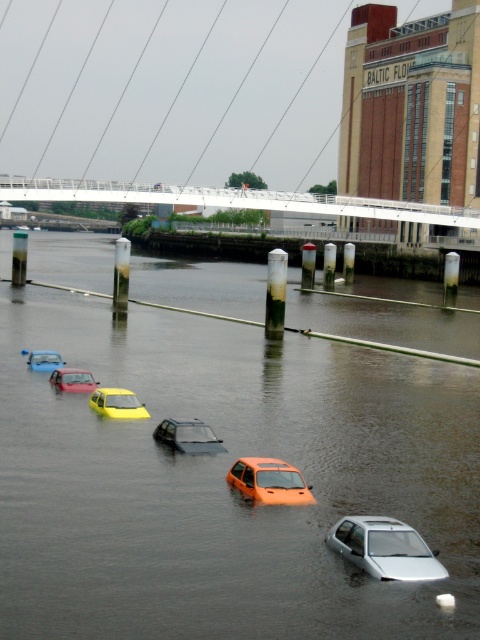
Can you confirm if metallic silver car at lower center is taller than metallic silver car at lower left?

No, metallic silver car at lower center is not taller than metallic silver car at lower left.

Identify the location of metallic silver car at lower center. (72, 380).

Between smooth water at center and shiny black car at center, which one has more height?

With more height is smooth water at center.

What do you see at coordinates (224, 481) in the screenshot? I see `smooth water at center` at bounding box center [224, 481].

This screenshot has height=640, width=480. I want to click on smooth water at center, so click(224, 481).

Who is taller, white matte car at lower right or shiny black car at center?

shiny black car at center is taller.

Can you confirm if white matte car at lower right is thinner than shiny black car at center?

Correct, white matte car at lower right's width is less than shiny black car at center's.

Where is `white matte car at lower right`? white matte car at lower right is located at coordinates (384, 548).

The height and width of the screenshot is (640, 480). In order to click on white matte car at lower right in this screenshot , I will do `click(384, 548)`.